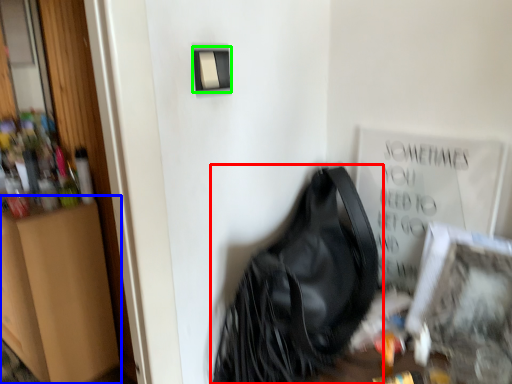
Question: Considering the real-world distances, which object is closest to handbag (highlighted by a red box)? dresser (highlighted by a blue box) or light switch (highlighted by a green box).

Choices:
 (A) dresser
 (B) light switch

Answer: (B)